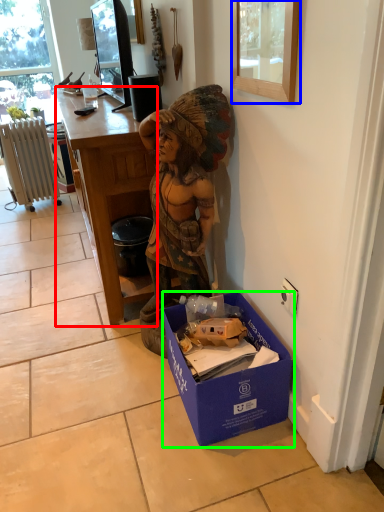
Question: Which object is positioned farthest from desk (highlighted by a red box)? Select from picture frame (highlighted by a blue box) and box (highlighted by a green box).

Choices:
 (A) picture frame
 (B) box

Answer: (A)